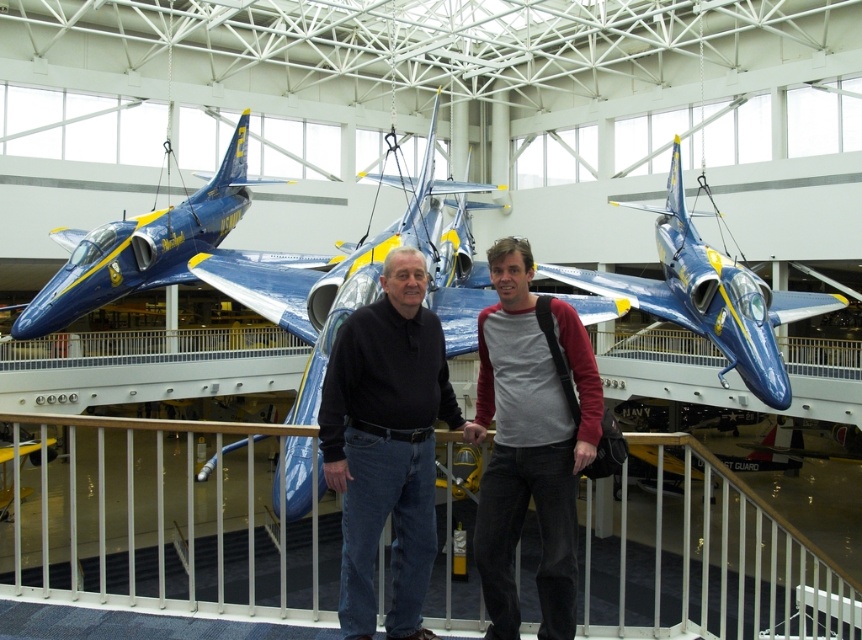
Question: Which point is closer to the camera taking this photo?

Choices:
 (A) (34, 324)
 (B) (725, 385)

Answer: (A)

Question: In this image, where is white metal railing at lower center located relative to gray cotton t-shirt at center?

Choices:
 (A) left
 (B) right

Answer: (A)

Question: In this image, where is black matte shirt at center located relative to gray cotton t-shirt at center?

Choices:
 (A) above
 (B) below

Answer: (A)

Question: Among these points, which one is nearest to the camera?

Choices:
 (A) (685, 301)
 (B) (401, 515)
 (C) (444, 628)

Answer: (B)

Question: Which of the following is the farthest from the observer?

Choices:
 (A) [431, 413]
 (B) [481, 392]
 (C) [720, 324]

Answer: (C)

Question: Does shiny blue jet at center appear over shiny blue airplane at center?

Choices:
 (A) no
 (B) yes

Answer: (A)